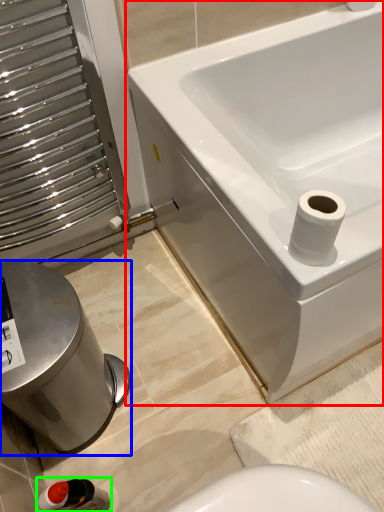
Question: Estimate the real-world distances between objects in this image. Which object is closer to bathtub (highlighted by a red box), bidet (highlighted by a blue box) or plumbing fixture (highlighted by a green box)?

Choices:
 (A) bidet
 (B) plumbing fixture

Answer: (A)